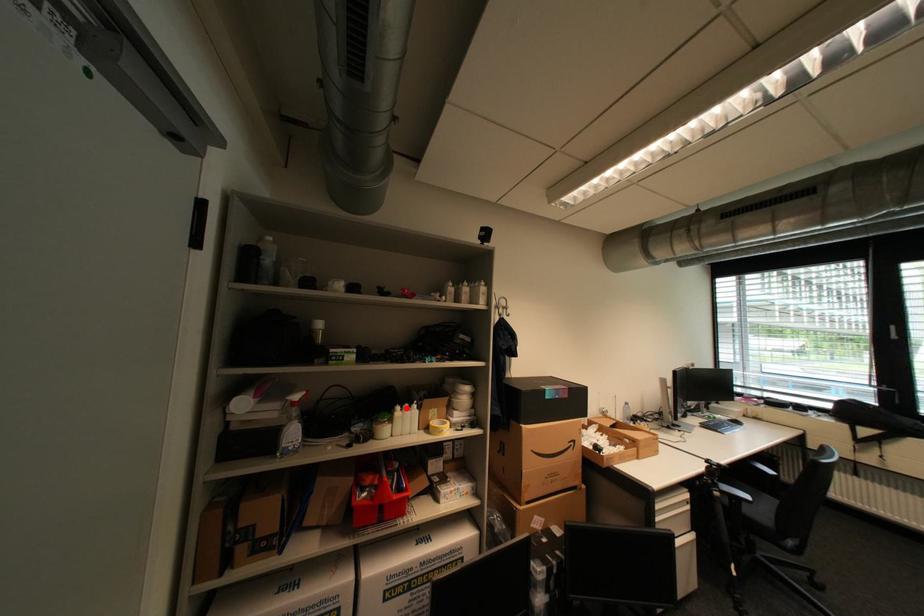
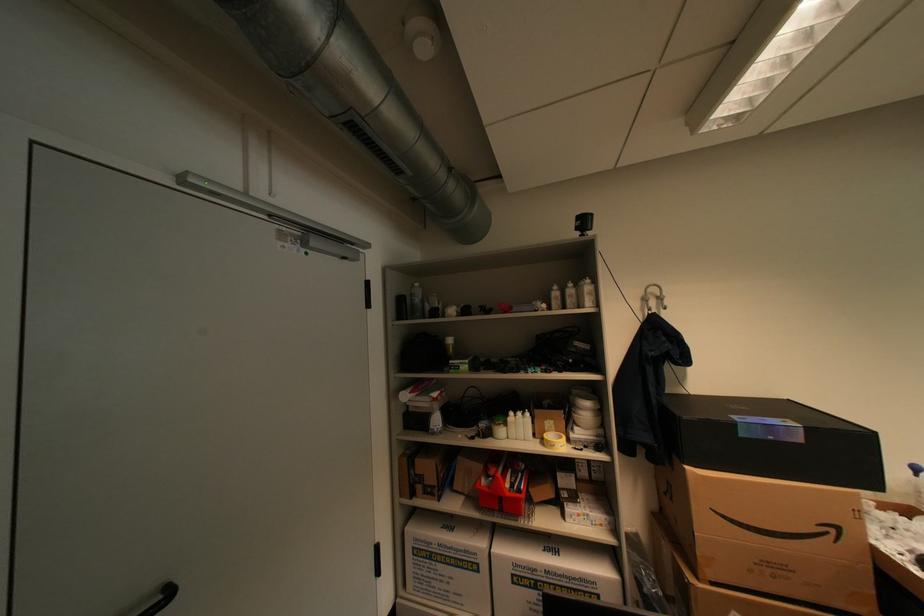
Locate, in the second image, the point that corresponds to the highlighted location in the first image.

(519, 414)